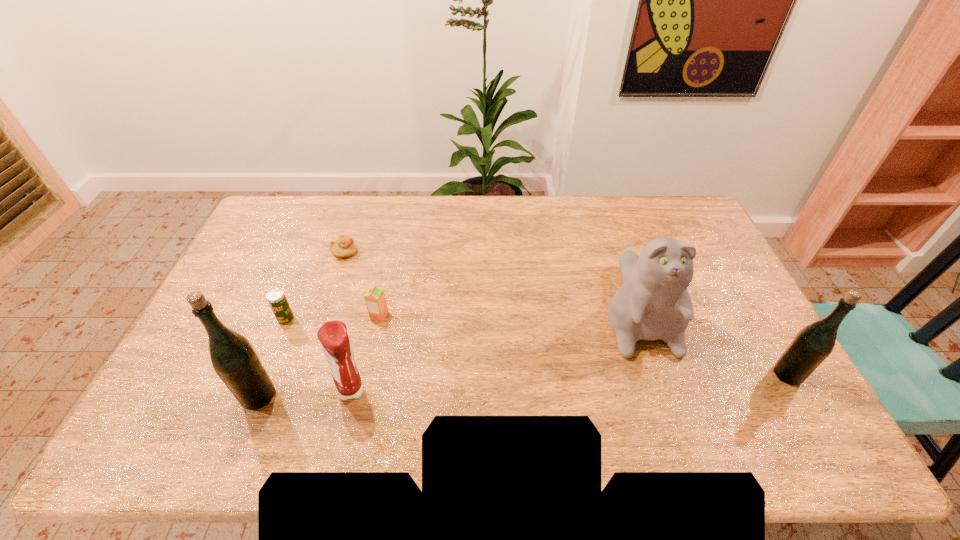
In the image, there is a desktop. Identify the location of free space at the far edge. The height and width of the screenshot is (540, 960). (620, 212).

The height and width of the screenshot is (540, 960). I want to click on free space at the near edge of the desktop, so (x=392, y=382).

This screenshot has height=540, width=960. In the image, there is a desktop. What are the coordinates of `vacant space at the right edge` in the screenshot? It's located at (734, 367).

In the image, there is a desktop. Identify the location of free space at the far left corner. The width and height of the screenshot is (960, 540). (293, 232).

This screenshot has height=540, width=960. I want to click on free point between the shortest object and the fourth tallest object, so click(x=348, y=321).

Locate an element on the screen. free space between the orange juice and the farthest object is located at coordinates (362, 284).

The image size is (960, 540). Identify the location of free space that is in between the cat and the farthest object. (491, 280).

The width and height of the screenshot is (960, 540). What are the coordinates of `empty space between the beer can and the orange juice` in the screenshot? It's located at (333, 318).

Locate an element on the screen. This screenshot has height=540, width=960. free space between the cat and the third object from left to right is located at coordinates (491, 280).

This screenshot has height=540, width=960. I want to click on vacant point located between the taller beer bottle and the beer can, so pos(273,357).